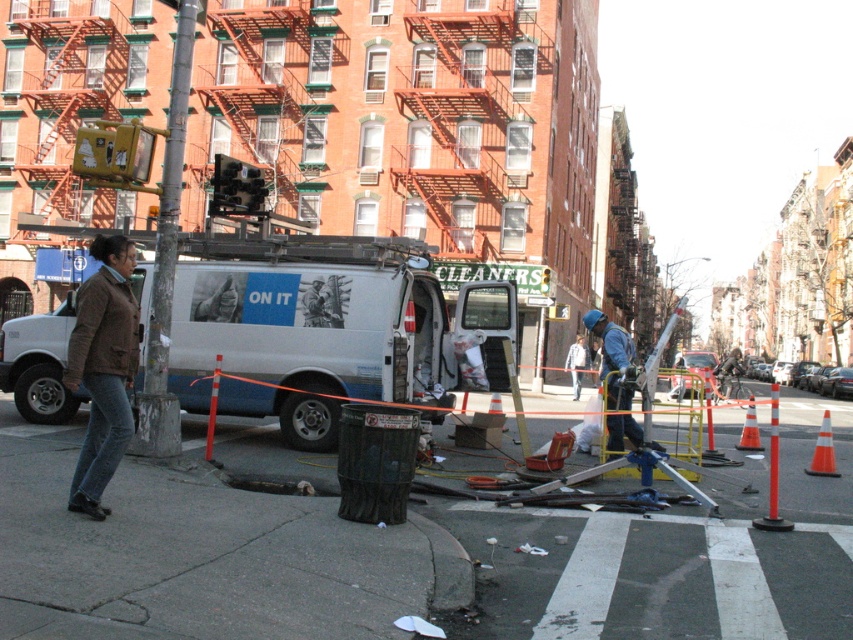
Does point (247, 330) come in front of point (111, 403)?

That is False.

Does point (437, 387) lie behind point (131, 316)?

That is True.

Is point (6, 369) behind point (94, 435)?

Yes, it is.

Image resolution: width=853 pixels, height=640 pixels. Identify the location of white matte van at center. (306, 326).

Does concrete sidewalk at lower left appear over white matte van at center?

No.

Consider the image. Is concrete sidewalk at lower left smaller than white matte van at center?

Actually, concrete sidewalk at lower left might be larger than white matte van at center.

The width and height of the screenshot is (853, 640). Identify the location of concrete sidewalk at lower left. (405, 552).

Does concrete sidewalk at lower left come in front of brown woolen jacket at lower left?

Yes, concrete sidewalk at lower left is in front of brown woolen jacket at lower left.

Which is behind, point (108, 532) or point (86, 349)?

Point (86, 349)

Does point (514, 614) come closer to viewer compared to point (100, 456)?

Yes, it is.

You are a GUI agent. You are given a task and a screenshot of the screen. Output one action in this format:
    pyautogui.click(x=<x>, y=<y>)
    Task: Click on the concrete sidewalk at lower left
    
    Given the screenshot: What is the action you would take?
    pyautogui.click(x=405, y=552)